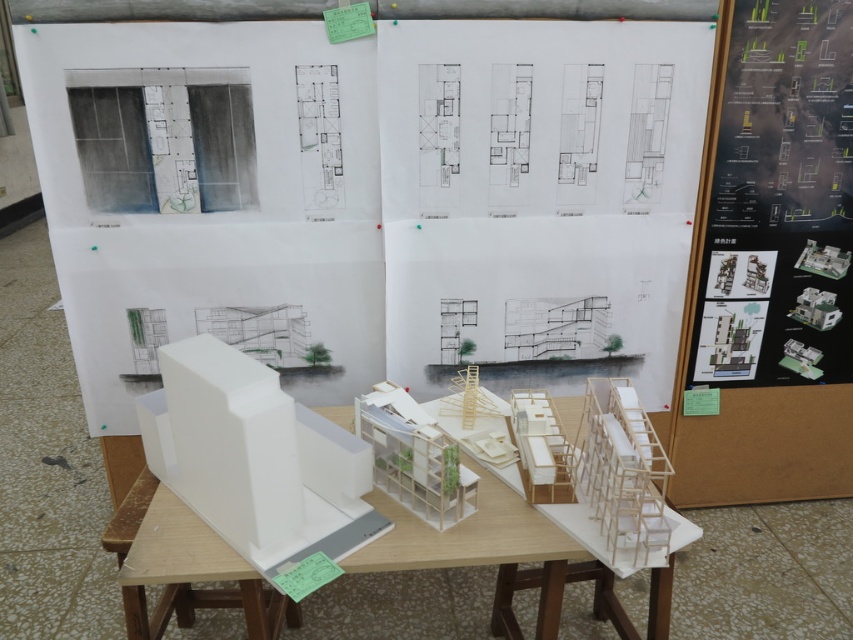
You are an architect reviewing the display setup. You need to determine which of the two white matte models, the white matte building at left or the white matte model building at center, has a greater width. Based on the information provided, which one is wider?

The white matte model building at center is wider than the white matte building at left.